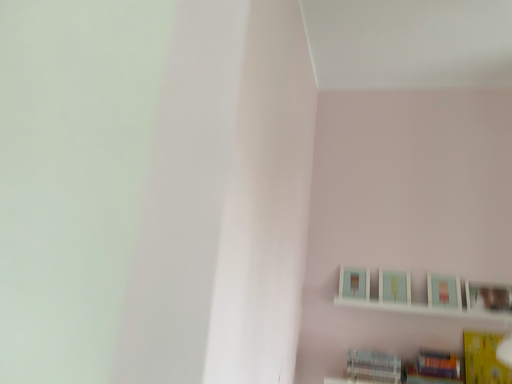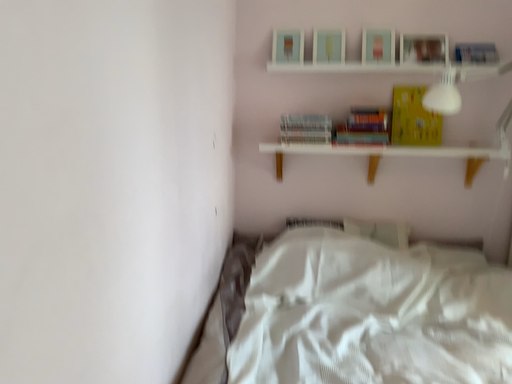
Question: Which way did the camera rotate in the video?

Choices:
 (A) rotated right
 (B) rotated left

Answer: (A)